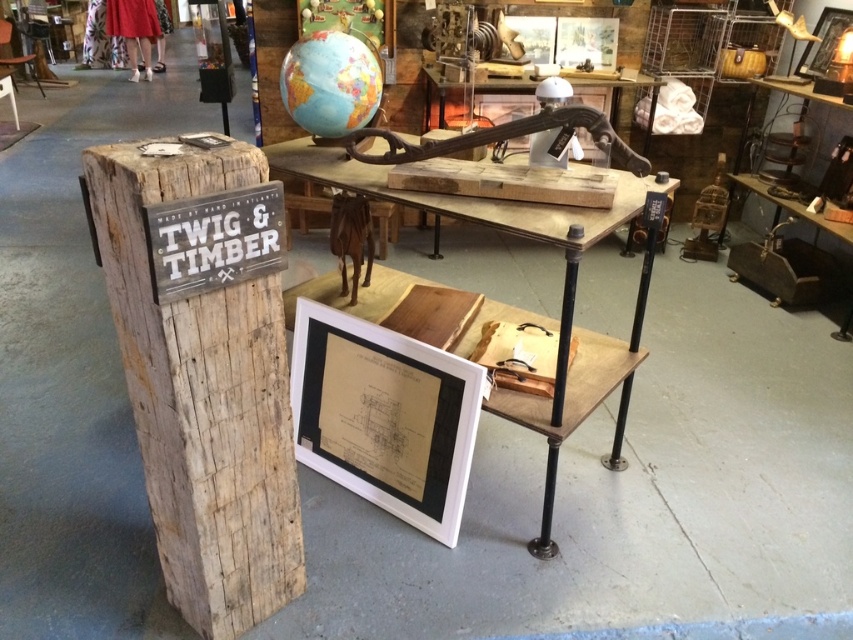
Question: Can you confirm if weathered wood sign at left is smaller than blue and green globe at upper center?

Choices:
 (A) no
 (B) yes

Answer: (A)

Question: Which of the following is the farthest from the observer?

Choices:
 (A) blue and green globe at upper center
 (B) wooden at center

Answer: (A)

Question: Can you confirm if weathered wood sign at left is wider than wooden at center?

Choices:
 (A) no
 (B) yes

Answer: (A)

Question: Considering the real-world distances, which object is farthest from the weathered wood sign at left?

Choices:
 (A) blue and green globe at upper center
 (B) wooden at center

Answer: (A)

Question: Is weathered wood sign at left to the left of wooden at center from the viewer's perspective?

Choices:
 (A) yes
 (B) no

Answer: (A)

Question: Which object is positioned closest to the wooden at center?

Choices:
 (A) blue and green globe at upper center
 (B) weathered wood sign at left

Answer: (A)